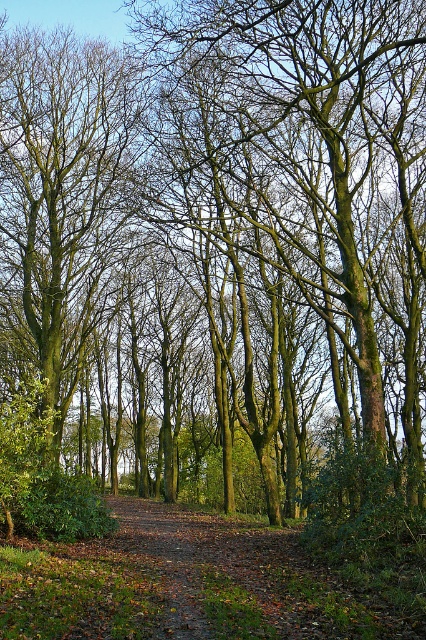
You are standing at the starting point of the dirt path in the forest. You want to reach the green mossy tree at center. Which direction should you walk?

You should walk towards the center of the forest where the green mossy tree at center is located at point coordinates of (x=63, y=198). Since the dirt path winds through the forest, following the path towards the center would lead you to the green mossy tree at center.

You are a hiker walking along the dirt path in the forest. You notice a green mossy tree at center and a brown leafy path at center. Which object is closer to you as you walk the path?

The green mossy tree at center is closer to you because the brown leafy path at center is behind it.